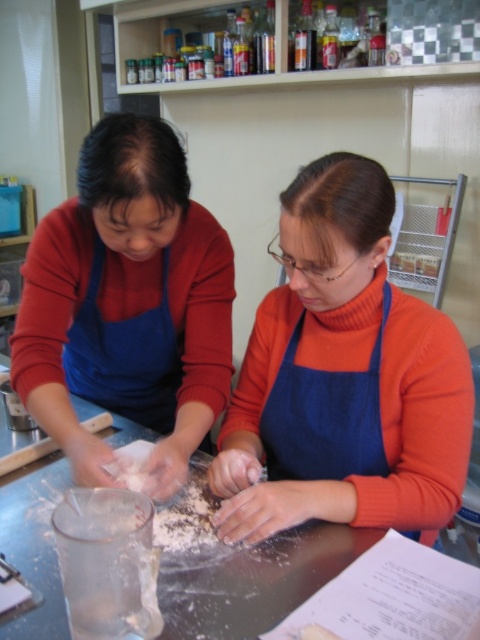
In the scene shown: You are a chef trying to decide whether to place a large cutting board on the metallic gray table at center. Considering the blue fabric apron at center is currently on the table, will there be enough space?

The blue fabric apron at center has a smaller width than the metallic gray table at center, so there should be enough space to place the large cutting board on the metallic gray table at center after removing the apron.

You are a chef standing in the kitchen and see the blue fabric apron at center and the metallic gray table at center. Which object is positioned higher from the floor?

The blue fabric apron at center is above the metallic gray table at center, so it is positioned higher from the floor.

You are a chef who needs to locate your blue fabric apron at center. According to the scene, where would you find it relative to the metallic gray table at center?

The blue fabric apron at center is to the right of the metallic gray table at center.